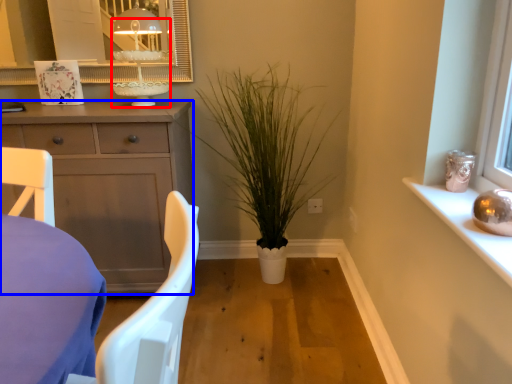
Question: Among these objects, which one is farthest to the camera, candle holder (highlighted by a red box) or cabinetry (highlighted by a blue box)?

Choices:
 (A) candle holder
 (B) cabinetry

Answer: (A)